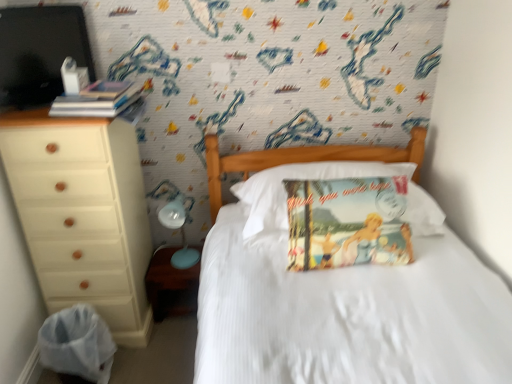
Question: Is point (328, 165) closer or farther from the camera than point (150, 288)?

Choices:
 (A) farther
 (B) closer

Answer: (B)

Question: From the image's perspective, is vintage paper pillow at center located above or below matte brown wood at lower left?

Choices:
 (A) below
 (B) above

Answer: (B)

Question: Considering the real-world distances, which object is closest to the white satin bed at center?

Choices:
 (A) white plastic bag at lower left
 (B) hardcover books at left, which is the 1th book in top-to-bottom order
 (C) light blue plastic table lamp at lower left
 (D) beige wood chest of drawers at left
 (E) vintage paper pillow at center

Answer: (E)

Question: Which is nearer to the matte brown wood at lower left?

Choices:
 (A) white satin bed at center
 (B) vintage paper pillow at center
 (C) white plastic bag at lower left
 (D) vintage paper pillow at center, the first book when ordered from right to left
 (E) light blue plastic table lamp at lower left

Answer: (E)